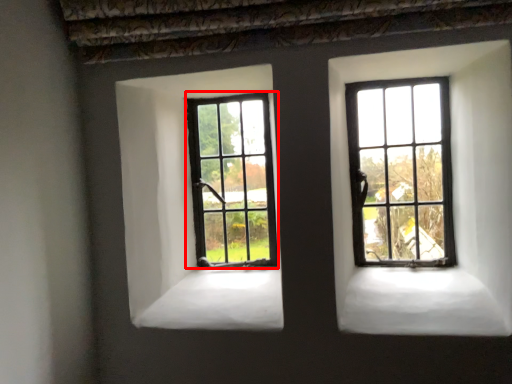
Question: Where is window (annotated by the red box) located in relation to window in the image?

Choices:
 (A) left
 (B) right

Answer: (A)